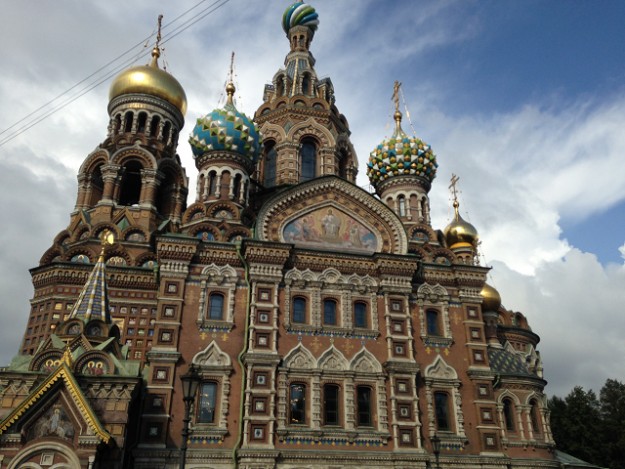
Find the location of `windows`. windows is located at coordinates (219, 304), (302, 307), (336, 313), (361, 314), (437, 323), (511, 419), (535, 414).